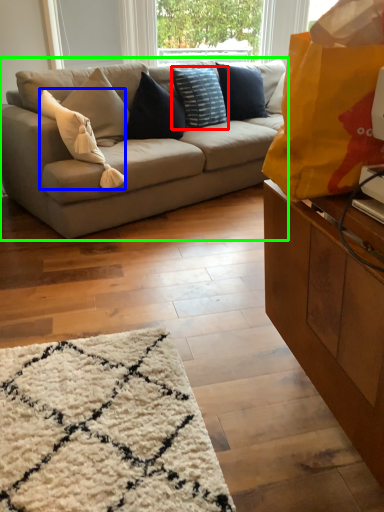
Question: Considering the real-world distances, which object is farthest from pillow (highlighted by a red box)? pillow (highlighted by a blue box) or studio couch (highlighted by a green box)?

Choices:
 (A) pillow
 (B) studio couch

Answer: (A)